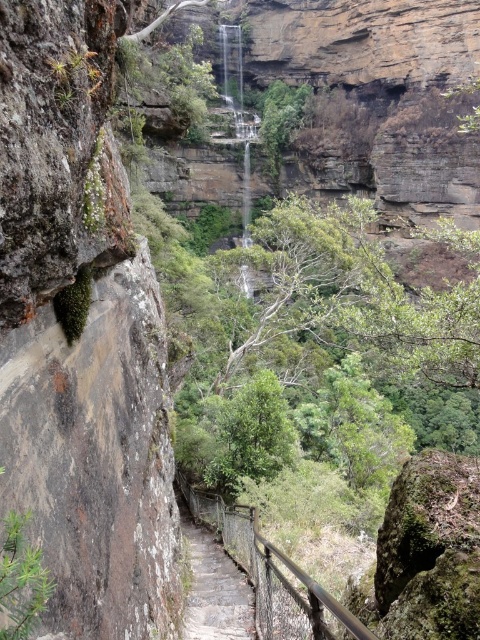
Is metal/rustic rail at center to the left of gray stone steps at center from the viewer's perspective?

No, metal/rustic rail at center is not to the left of gray stone steps at center.

Which is behind, point (311, 618) or point (218, 625)?

The point (218, 625) is behind.

This screenshot has width=480, height=640. I want to click on metal/rustic rail at center, so 273,576.